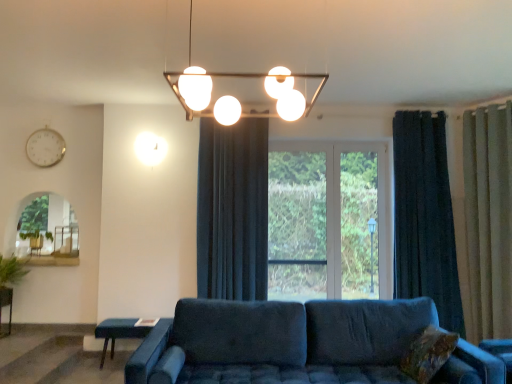
Question: Is dark blue velvet curtain at center, which appears as the 3th curtain when viewed from the right, not within white metallic clock at upper left?

Choices:
 (A) no
 (B) yes

Answer: (B)

Question: Is dark blue velvet curtain at center, which appears as the 3th curtain when viewed from the right, wider than white metallic clock at upper left?

Choices:
 (A) yes
 (B) no

Answer: (A)

Question: Can you confirm if dark blue velvet curtain at center, the first curtain in the left-to-right sequence, is positioned to the left of white metallic clock at upper left?

Choices:
 (A) no
 (B) yes

Answer: (A)

Question: Is dark blue velvet curtain at center, which appears as the 3th curtain when viewed from the right, thinner than white metallic clock at upper left?

Choices:
 (A) yes
 (B) no

Answer: (B)

Question: Considering the relative sizes of dark blue velvet curtain at center, the first curtain in the left-to-right sequence, and white metallic clock at upper left in the image provided, is dark blue velvet curtain at center, the first curtain in the left-to-right sequence, smaller than white metallic clock at upper left?

Choices:
 (A) no
 (B) yes

Answer: (A)

Question: Is beige fabric curtain at right, arranged as the 1th curtain when viewed from the right, bigger or smaller than brown textured pillow at lower right?

Choices:
 (A) big
 (B) small

Answer: (A)

Question: In terms of height, does beige fabric curtain at right, arranged as the 1th curtain when viewed from the right, look taller or shorter compared to brown textured pillow at lower right?

Choices:
 (A) short
 (B) tall

Answer: (B)

Question: From the image's perspective, is beige fabric curtain at right, the third curtain when ordered from left to right, located above or below brown textured pillow at lower right?

Choices:
 (A) above
 (B) below

Answer: (A)

Question: Choose the correct answer: Is beige fabric curtain at right, the third curtain when ordered from left to right, inside brown textured pillow at lower right or outside it?

Choices:
 (A) inside
 (B) outside

Answer: (B)

Question: Is metallic pendant light at upper center taller or shorter than white metallic clock at upper left?

Choices:
 (A) short
 (B) tall

Answer: (B)

Question: Considering the positions of metallic pendant light at upper center and white metallic clock at upper left in the image, is metallic pendant light at upper center wider or thinner than white metallic clock at upper left?

Choices:
 (A) thin
 (B) wide

Answer: (B)

Question: Does point (195, 76) appear closer or farther from the camera than point (41, 140)?

Choices:
 (A) farther
 (B) closer

Answer: (B)

Question: Based on their sizes in the image, would you say metallic pendant light at upper center is bigger or smaller than white metallic clock at upper left?

Choices:
 (A) big
 (B) small

Answer: (A)

Question: Does point (121, 322) appear closer or farther from the camera than point (478, 319)?

Choices:
 (A) closer
 (B) farther

Answer: (B)

Question: From a real-world perspective, is blue fabric table at lower left, the 1th table positioned from the right, above or below beige fabric curtain at right, arranged as the 1th curtain when viewed from the right?

Choices:
 (A) below
 (B) above

Answer: (A)